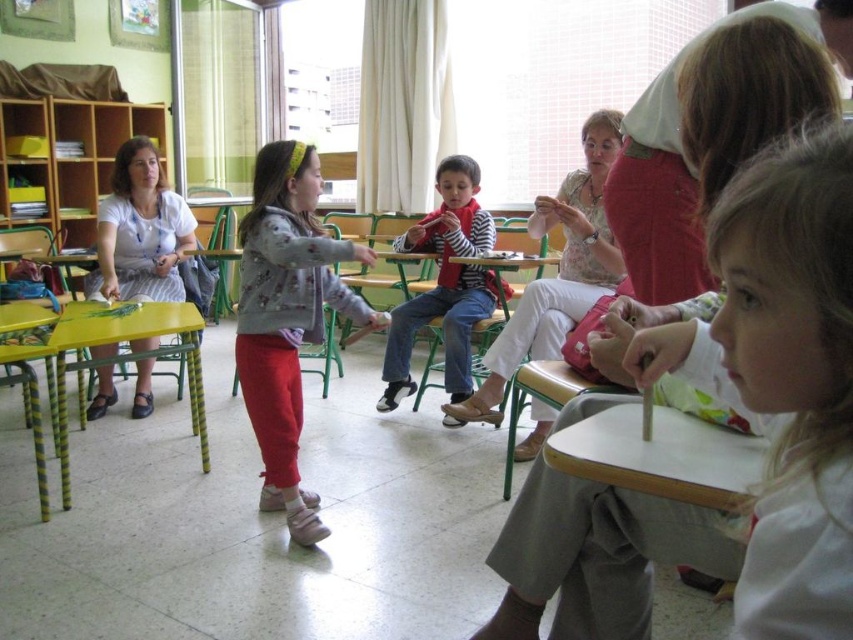
Question: Does fluffy gray sweater at center have a lesser width compared to striped cotton shirt at center?

Choices:
 (A) no
 (B) yes

Answer: (B)

Question: Which point is farther to the camera?

Choices:
 (A) fluffy gray sweater at center
 (B) striped cotton shirt at center

Answer: (B)

Question: Can you confirm if fluffy gray sweater at center is positioned to the left of striped cotton shirt at center?

Choices:
 (A) no
 (B) yes

Answer: (B)

Question: Among these objects, which one is nearest to the camera?

Choices:
 (A) fluffy gray sweater at center
 (B) striped cotton shirt at center

Answer: (A)

Question: Is fluffy gray sweater at center positioned in front of striped cotton shirt at center?

Choices:
 (A) yes
 (B) no

Answer: (A)

Question: Which point is farther from the camera taking this photo?

Choices:
 (A) (422, 236)
 (B) (252, 288)

Answer: (A)